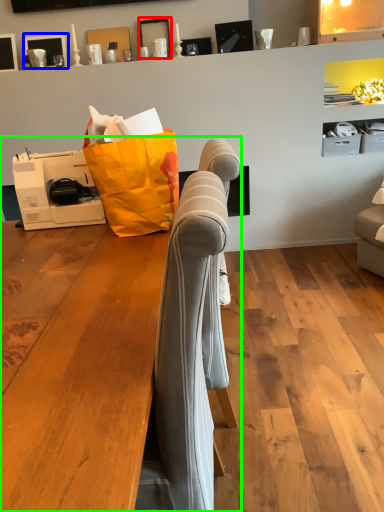
Question: Considering the real-world distances, which object is closest to picture frame (highlighted by a red box)? picture frame (highlighted by a blue box) or furniture (highlighted by a green box).

Choices:
 (A) picture frame
 (B) furniture

Answer: (A)